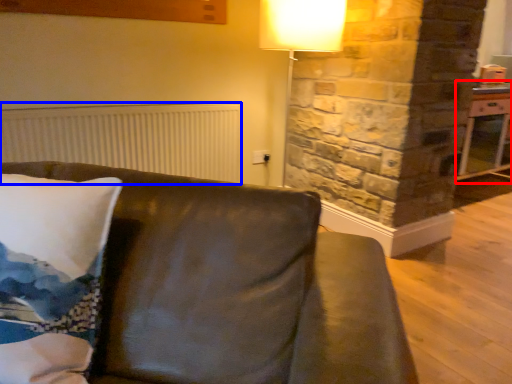
Question: Which object appears closest to the camera in this image, table (highlighted by a red box) or radiator (highlighted by a blue box)?

Choices:
 (A) table
 (B) radiator

Answer: (B)